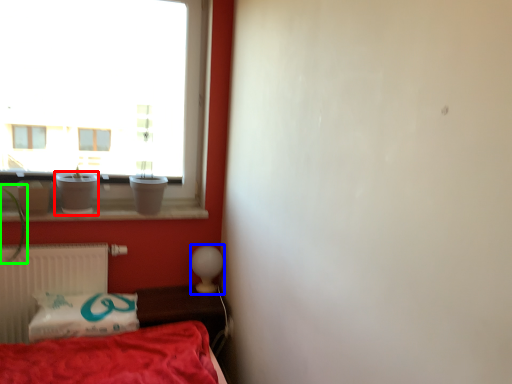
Question: Based on their relative distances, which object is nearer to glass vase (highlighted by a red box)? Choose from table lamp (highlighted by a blue box) and plant (highlighted by a green box).

Choices:
 (A) table lamp
 (B) plant

Answer: (B)